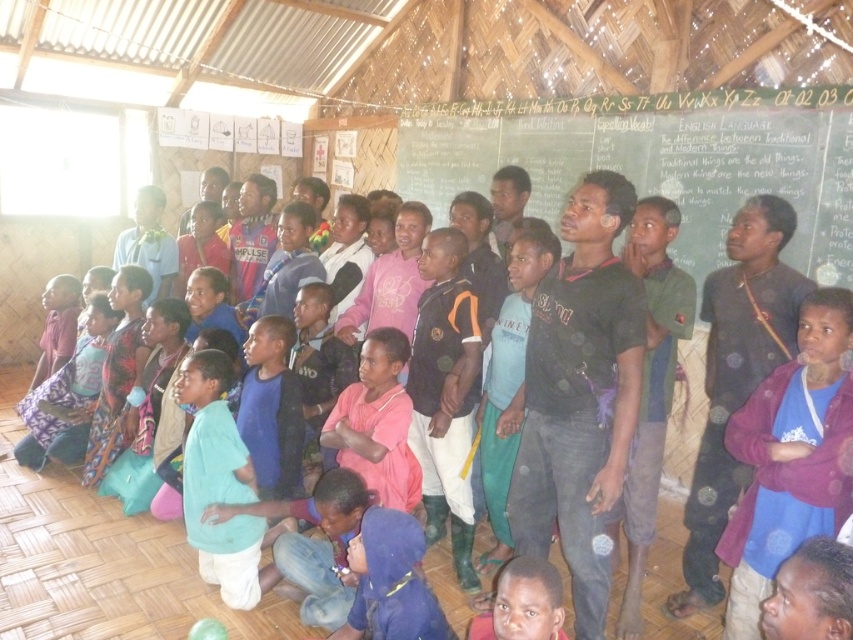
You are standing in the classroom and see the point at coordinates (x=105, y=570). What object is located at that point?

The pink fabric at center is located at point (x=105, y=570).

You are a photographer trying to capture a group photo of the children. You notice the pink fabric at center and the purple fleece jacket at right. To ensure both are visible in the frame, which object should you position closer to the center of your camera viewfinder?

The pink fabric at center is positioned on the left side of the purple fleece jacket at right. To ensure both are visible, position the pink fabric at center closer to the center of the camera viewfinder since it is already closer to the middle of the scene compared to the purple fleece jacket at right.

You are a teacher standing at the front of the classroom. You need to write an important note on the green chalkboard at upper center. Where exactly should you position yourself to ensure you can clearly see the entire chalkboard while facing the children?

The green chalkboard at upper center is located at point 0.252 on the horizontal axis and 0.771 on the vertical axis. To ensure clear visibility of the entire board while facing the children, you should position yourself slightly to the left of the chalkboard so that you can see its full width and height without obstruction.